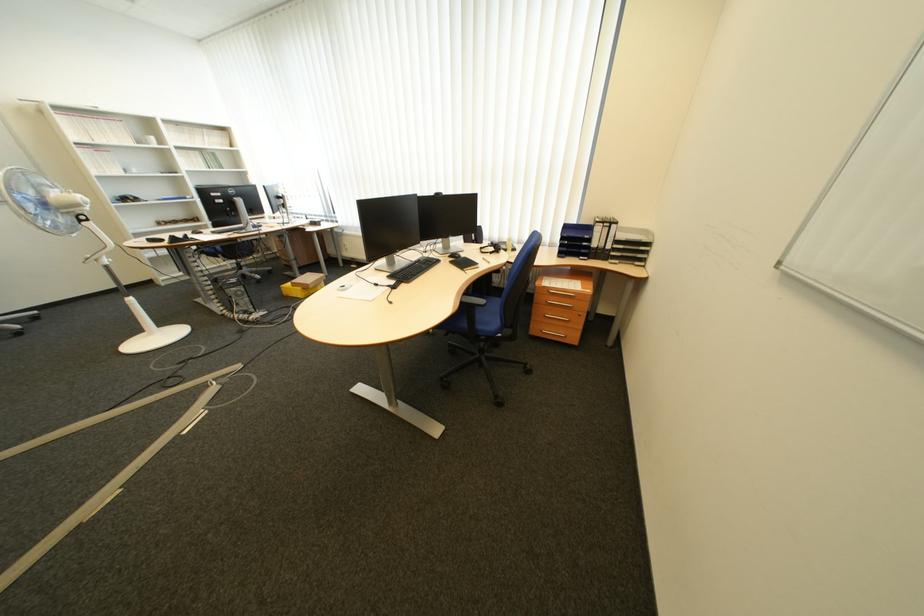
This screenshot has width=924, height=616. What do you see at coordinates (497, 384) in the screenshot?
I see `a blue chair sitting surface` at bounding box center [497, 384].